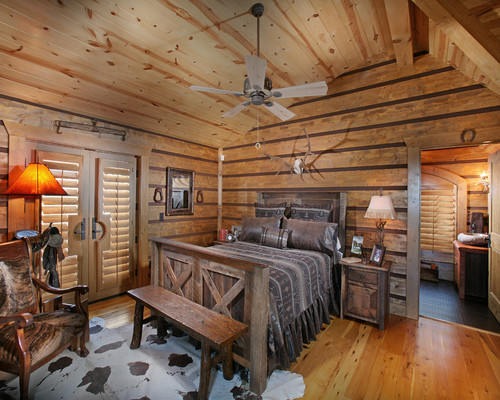
You are a GUI agent. You are given a task and a screenshot of the screen. Output one action in this format:
    pyautogui.click(x=<x>, y=<y>)
    Task: Click on the bed frame
    
    Given the screenshot: What is the action you would take?
    pyautogui.click(x=219, y=273)